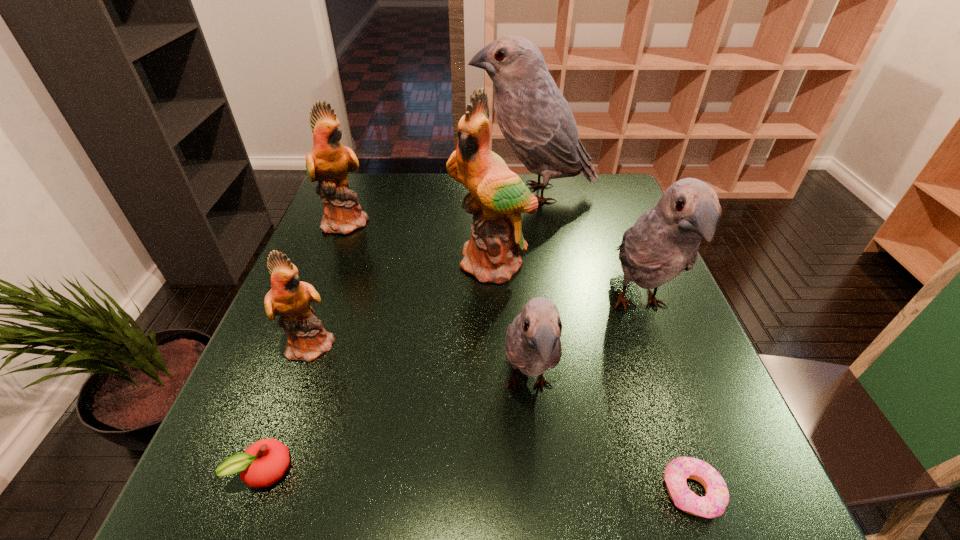
The width and height of the screenshot is (960, 540). I want to click on vacant space that satisfies the following two spatial constraints: 1. on the front-facing side of the second smallest gray parrot; 2. on the front-facing side of the nearest green parrot, so click(x=653, y=344).

Locate an element on the screen. Image resolution: width=960 pixels, height=540 pixels. free space that satisfies the following two spatial constraints: 1. on the front-facing side of the shortest object; 2. on the right side of the nearest green parrot is located at coordinates (259, 492).

Locate an element on the screen. This screenshot has height=540, width=960. free space in the image that satisfies the following two spatial constraints: 1. on the back side of the second shortest object; 2. on the front-facing side of the farthest green parrot is located at coordinates [355, 221].

Image resolution: width=960 pixels, height=540 pixels. Find the location of `free space in the image that satisfies the following two spatial constraints: 1. on the front-facing side of the biggest green parrot; 2. on the front-facing side of the nearest green parrot`. free space in the image that satisfies the following two spatial constraints: 1. on the front-facing side of the biggest green parrot; 2. on the front-facing side of the nearest green parrot is located at coordinates (495, 344).

At what (x,y) coordinates should I click in order to perform the action: click on free point that satisfies the following two spatial constraints: 1. on the front-facing side of the farthest green parrot; 2. on the back side of the doughnut. Please return your answer as a coordinate pair (x, y). Looking at the image, I should click on pyautogui.click(x=242, y=492).

Locate an element on the screen. vacant space that satisfies the following two spatial constraints: 1. on the front-facing side of the red apple; 2. on the right side of the second biggest green parrot is located at coordinates (251, 470).

You are a GUI agent. You are given a task and a screenshot of the screen. Output one action in this format:
    pyautogui.click(x=<x>, y=<y>)
    Task: Click on the free space that satisfies the following two spatial constraints: 1. on the front-facing side of the rightmost green parrot; 2. on the front-facing side of the smallest green parrot
    The height and width of the screenshot is (540, 960).
    Given the screenshot: What is the action you would take?
    pyautogui.click(x=495, y=344)